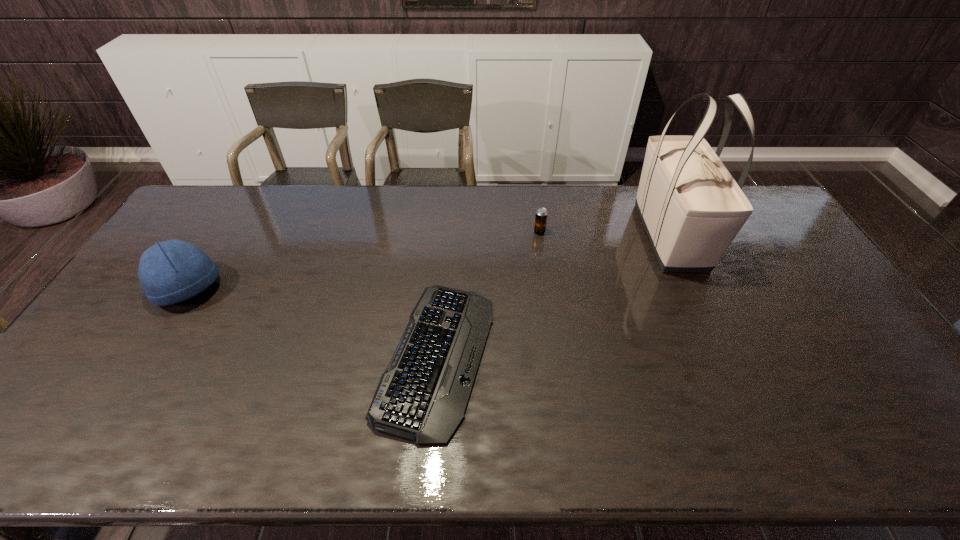
The height and width of the screenshot is (540, 960). Find the location of `vacant space that's between the shortest object and the shopping bag`. vacant space that's between the shortest object and the shopping bag is located at coordinates (553, 296).

At what (x,y) coordinates should I click in order to perform the action: click on free area in between the second tallest object and the rightmost object. Please return your answer as a coordinate pair (x, y). Image resolution: width=960 pixels, height=540 pixels. Looking at the image, I should click on (429, 263).

Identify the location of free space between the second shortest object and the tallest object. click(x=605, y=234).

Image resolution: width=960 pixels, height=540 pixels. In order to click on vacant region between the third object from left to right and the skullcap in this screenshot , I will do `click(364, 261)`.

In order to click on vacant area between the tallest object and the beer can in this screenshot , I will do `click(605, 234)`.

Find the location of `vacant region between the skullcap and the rightmost object`. vacant region between the skullcap and the rightmost object is located at coordinates (429, 263).

Identify the location of blank region between the second tallest object and the rightmost object. Image resolution: width=960 pixels, height=540 pixels. (429, 263).

Locate an element on the screen. unoccupied area between the second shortest object and the shopping bag is located at coordinates (605, 234).

This screenshot has height=540, width=960. In order to click on blank region between the rightmost object and the skullcap in this screenshot , I will do `click(429, 263)`.

Locate an element on the screen. vacant area between the leftmost object and the third object from right to left is located at coordinates (312, 323).